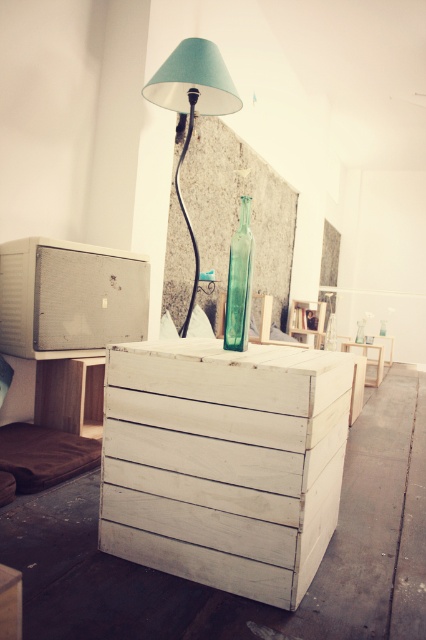
Consider the image. You are an interior designer planning to place a new rectangular shelf between the white wood crate at center and the matte teal lampshade at upper center. Since the shelf must fit snugly between them, which object should determine the minimum width of the shelf to ensure it accommodates both?

The white wood crate at center has a greater width than the matte teal lampshade at upper center, so the shelf should be at least as wide as the white wood crate at center to accommodate both objects.

You are moving a 5 meter long sofa into the room. The sofa is too long to fit through the doorway. You need to disassemble it before moving it in. After disassembling, the sofa parts are 2 meters each. You want to place them temporarily on the white wood crate at center and the white wood table at center. Is there enough space to place both sofa parts on both objects?

The white wood crate at center and white wood table at center are 4.58 meters apart from each other. Since each sofa part is 2 meters long, placing them on both objects would require a total length of 4 meters, which is less than the distance between them. Therefore, there is enough space to place both sofa parts on both objects.

You are an interior designer planning to place a new rectangular rug in the center of the room. Considering the positions of the matte teal lampshade at upper center and the white wood table at center, which object would be closer to the edge of the rug if the rug is placed directly under both?

The matte teal lampshade at upper center would be closer to the edge of the rug since it has a lesser width compared to the white wood table at center, meaning it occupies less space and is positioned further outward.